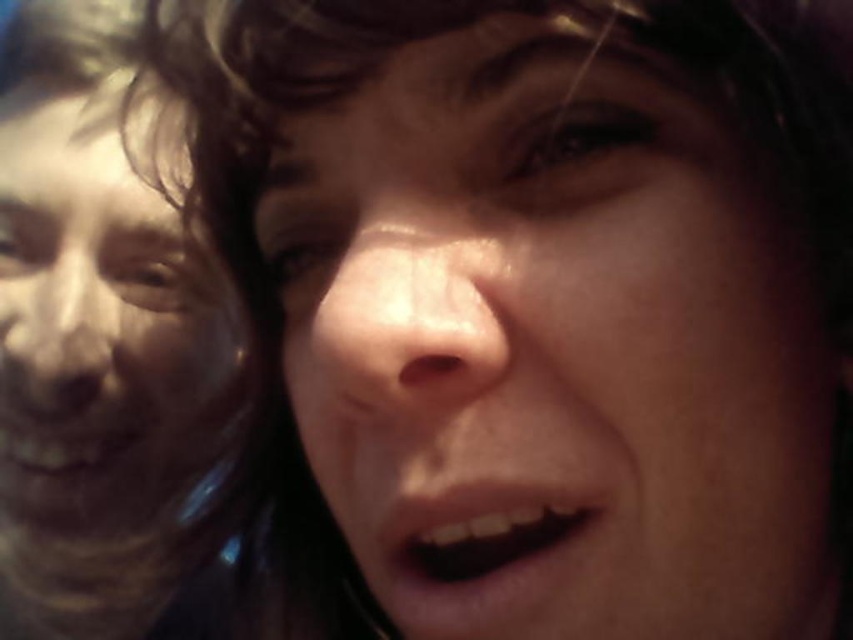
Question: In this image, where is smooth skin face at center located relative to smooth skin face at left?

Choices:
 (A) above
 (B) below

Answer: (B)

Question: Which of the following is the closest to the observer?

Choices:
 (A) (103, 364)
 (B) (805, 392)

Answer: (B)

Question: Can you confirm if smooth skin face at center is thinner than smooth skin face at left?

Choices:
 (A) no
 (B) yes

Answer: (A)

Question: Can you confirm if smooth skin face at center is bigger than smooth skin face at left?

Choices:
 (A) no
 (B) yes

Answer: (A)

Question: Among these points, which one is farthest from the camera?

Choices:
 (A) (19, 385)
 (B) (756, 266)

Answer: (A)

Question: Which object is farther from the camera taking this photo?

Choices:
 (A) smooth skin face at center
 (B) smooth skin face at left

Answer: (B)